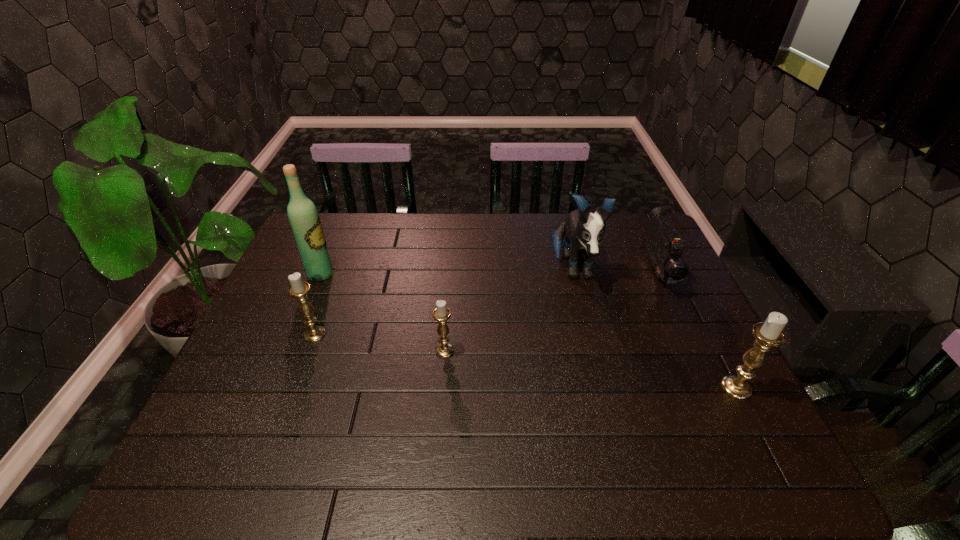
Identify the location of free space located 0.240m on the front of the third nearest object. (280, 426).

At what (x,y) coordinates should I click in order to perform the action: click on vacant space located on the left of the third object from left to right. Please return your answer as a coordinate pair (x, y). This screenshot has height=540, width=960. Looking at the image, I should click on (323, 351).

Locate an element on the screen. free location located 0.150m on the back of the nearest object is located at coordinates (707, 330).

Locate an element on the screen. This screenshot has width=960, height=540. free spot located 0.290m on the front-facing side of the wine bottle is located at coordinates (428, 274).

This screenshot has width=960, height=540. In order to click on free region located 0.350m on the front-facing side of the camcorder in this screenshot , I will do `click(721, 408)`.

Identify the location of free space located 0.140m on the front-facing side of the fourth object from left to right. click(x=589, y=336).

This screenshot has height=540, width=960. I want to click on camcorder present at the far edge, so click(x=664, y=245).

This screenshot has width=960, height=540. What are the coordinates of `puppy present at the far edge` in the screenshot? It's located at (583, 231).

Find the location of a particular element. Image resolution: width=960 pixels, height=540 pixels. object at the near edge is located at coordinates (768, 334).

The image size is (960, 540). In order to click on candle holder located at the left edge in this screenshot , I will do `click(298, 289)`.